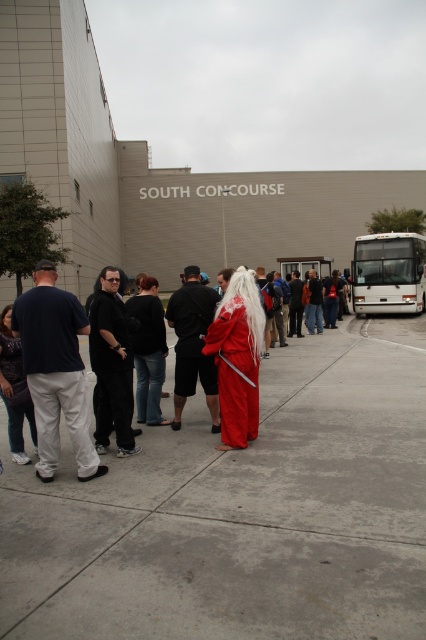
You are standing at the SOUTH CONCOURSE entrance and see the white matte bus at right and the dark blue jeans at center. Which object is positioned higher in the image?

The white matte bus at right is located above the dark blue jeans at center, so it is positioned higher in the image.